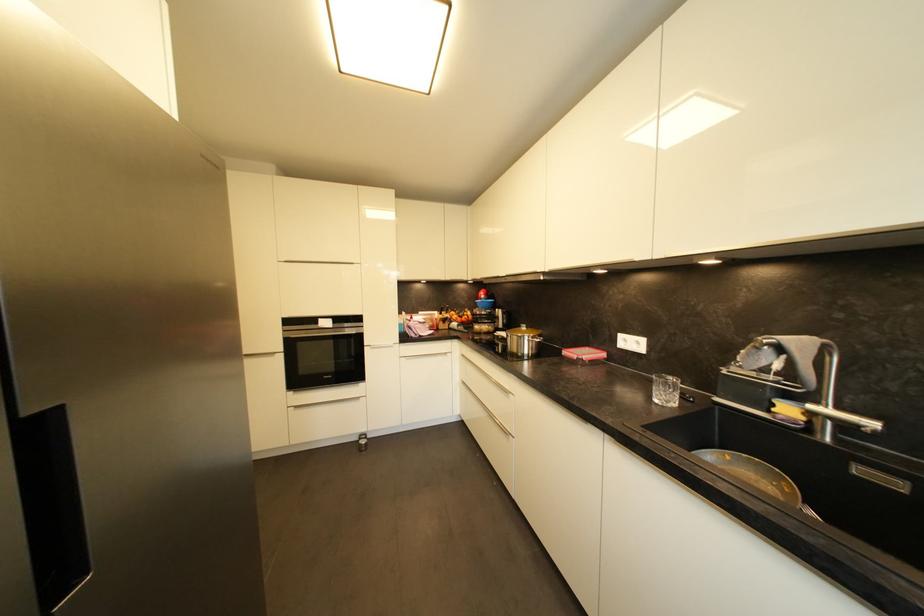
Where would you pull the oven door handle? Please return your answer as a coordinate pair (x, y).

(322, 330)